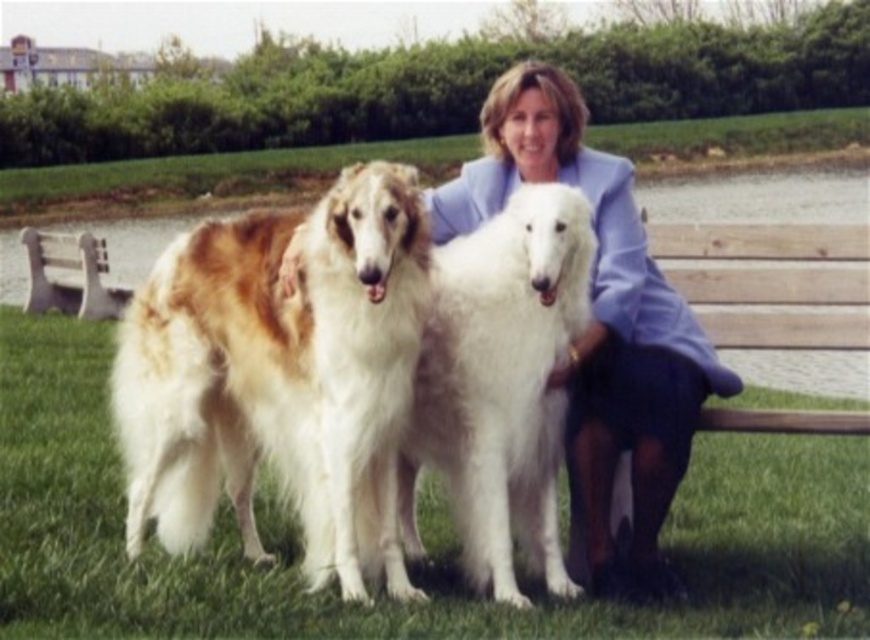
Can you confirm if light blue fabric at center is positioned to the right of white fluffy dog at center?

Indeed, light blue fabric at center is positioned on the right side of white fluffy dog at center.

Is point (526, 176) positioned behind point (410, 481)?

Yes, it is behind point (410, 481).

Measure the distance between point (704, 353) and camera.

4.64 meters

Locate an element on the screen. The image size is (870, 640). light blue fabric at center is located at coordinates (599, 328).

What do you see at coordinates (599, 328) in the screenshot? The image size is (870, 640). I see `light blue fabric at center` at bounding box center [599, 328].

Is light blue fabric at center thinner than white wood bench at left?

Incorrect, light blue fabric at center's width is not less than white wood bench at left's.

Is point (632, 332) behind point (64, 266)?

No, (632, 332) is in front of (64, 266).

Where is `light blue fabric at center`? The height and width of the screenshot is (640, 870). light blue fabric at center is located at coordinates (599, 328).

Looking at this image, does golden fur dog at center appear under light blue fabric at center?

Indeed, golden fur dog at center is positioned under light blue fabric at center.

Does golden fur dog at center have a lesser height compared to light blue fabric at center?

Indeed, golden fur dog at center has a lesser height compared to light blue fabric at center.

This screenshot has height=640, width=870. What do you see at coordinates (280, 376) in the screenshot?
I see `golden fur dog at center` at bounding box center [280, 376].

This screenshot has height=640, width=870. Find the location of `golden fur dog at center`. golden fur dog at center is located at coordinates (280, 376).